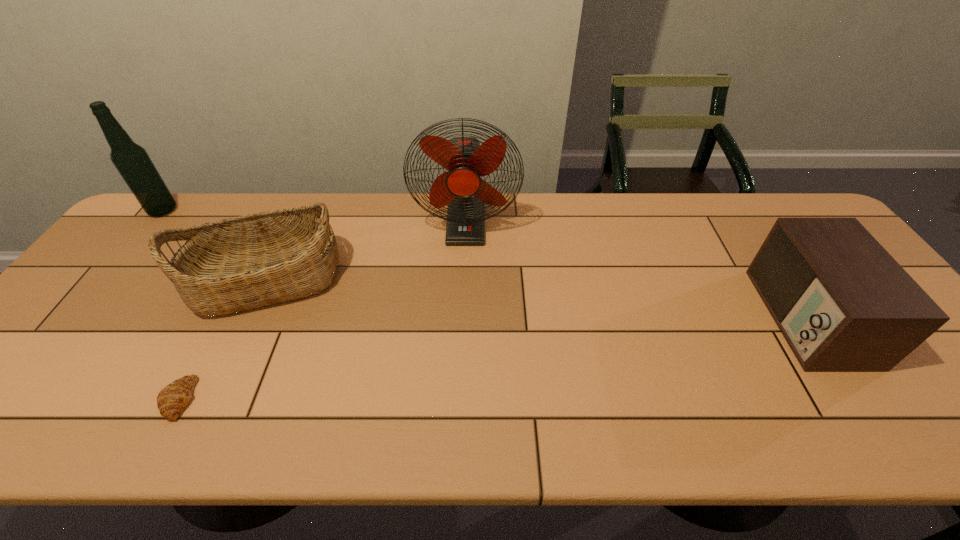
Locate an element on the screen. The image size is (960, 540). fan is located at coordinates (466, 160).

Identify the location of the leftmost object. The image size is (960, 540). (131, 160).

At what (x,y) coordinates should I click in order to perform the action: click on basket. Please return your answer as a coordinate pair (x, y). Looking at the image, I should click on (240, 263).

Locate an element on the screen. This screenshot has width=960, height=540. the rightmost object is located at coordinates (842, 302).

This screenshot has width=960, height=540. I want to click on crescent roll, so click(171, 400).

Find the location of a particular element. The width and height of the screenshot is (960, 540). the nearest object is located at coordinates (171, 400).

This screenshot has height=540, width=960. Identify the location of vacant region located on the front-facing side of the fan. (462, 345).

You are a GUI agent. You are given a task and a screenshot of the screen. Output one action in this format:
    pyautogui.click(x=<x>, y=<y>)
    Task: Click on the free point located on the right of the leftmost object
    
    Given the screenshot: What is the action you would take?
    pyautogui.click(x=296, y=211)

Where is `vacant space located on the left of the basket`? The image size is (960, 540). vacant space located on the left of the basket is located at coordinates 168,279.

This screenshot has height=540, width=960. I want to click on free spot located 0.360m on the front-facing side of the rightmost object, so click(x=620, y=317).